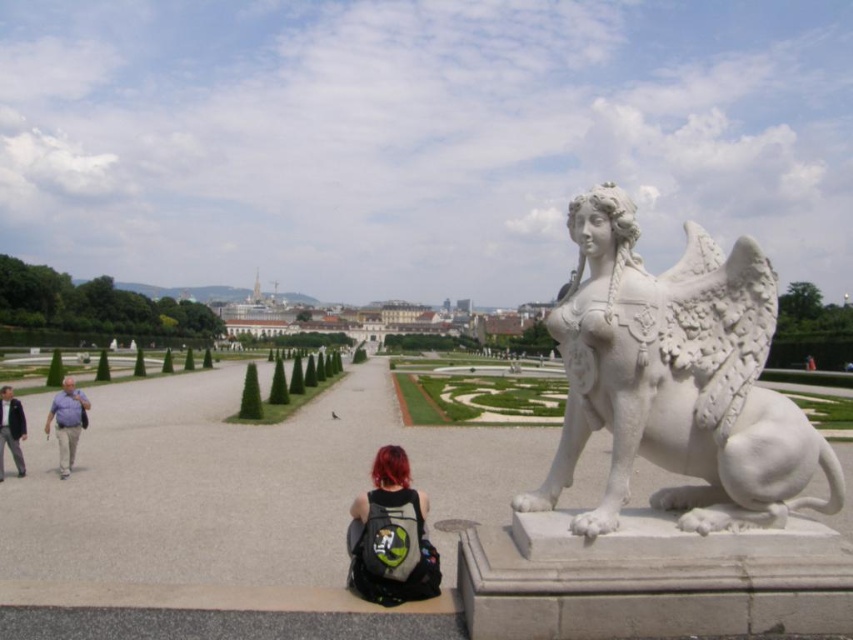
You are a fashion designer observing people in the park. You notice two individuals wearing the matte gray shirt at left and the light brown leather jacket at lower left. Which clothing item appears bigger on their respective wearers?

The matte gray shirt at left has a larger size compared to the light brown leather jacket at lower left, so it appears bigger on their respective wearers.

In the scene shown: You are a park visitor carrying a shiny black backpack at center and wearing a matte gray shirt at left. You want to place your backpack on the ground near the statue. However, there is limited space between you and the statue. Can your backpack fit in the space if the space is only 30 cm wide?

The shiny black backpack at center is smaller than the matte gray shirt at left. However, the size comparison between the backpack and the 30 cm space isn

You are a park visitor who wants to place your shiny black backpack at center and matte gray shirt at left in the park. According to the scene, where should you place each item so they don

The shiny black backpack at center should be placed to the right of the matte gray shirt at left because the shiny black backpack at center is positioned on the right side of matte gray shirt at left.